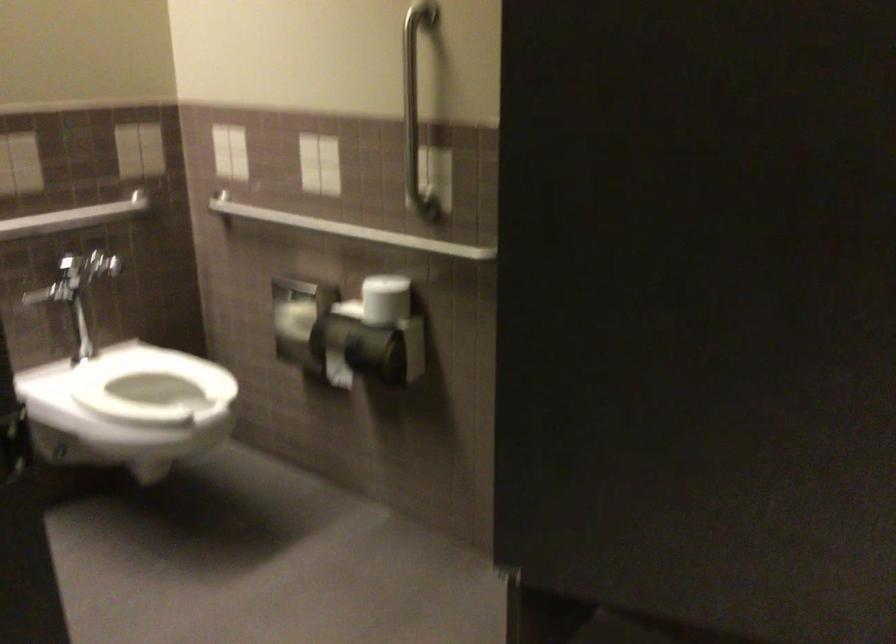
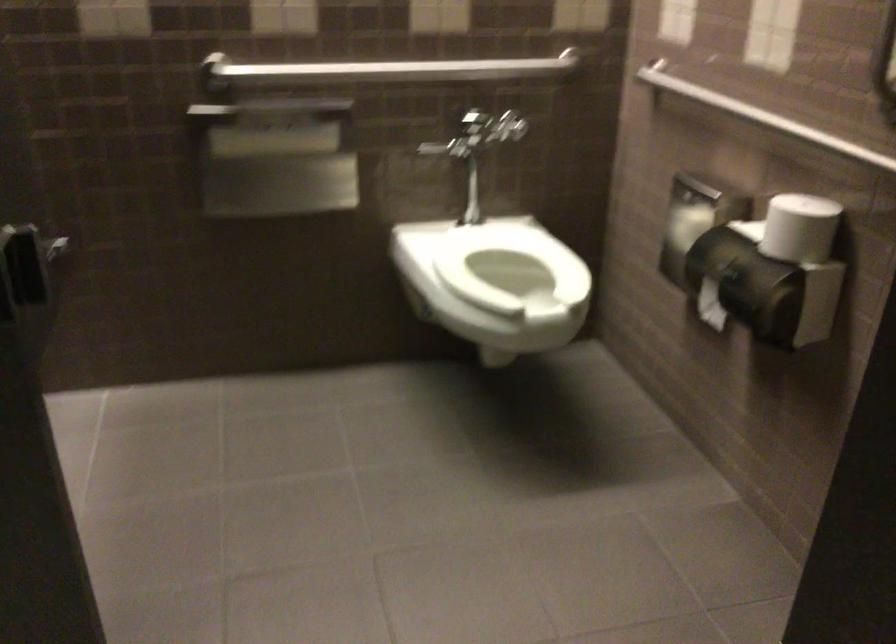
Question: The camera is either moving clockwise (left) or counter-clockwise (right) around the object. The first image is from the beginning of the video and the second image is from the end. Is the camera moving left or right when shooting the video?

Choices:
 (A) Left
 (B) Right

Answer: (B)